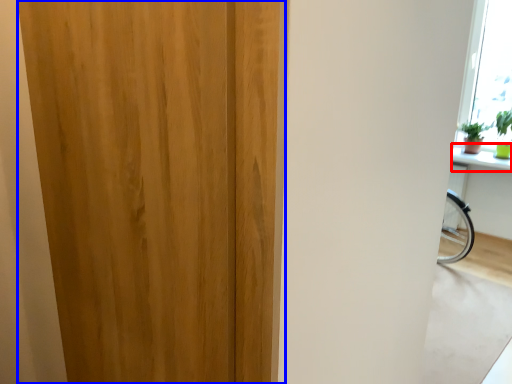
Question: Which of the following is the farthest to the observer, window sill (highlighted by a red box) or door (highlighted by a blue box)?

Choices:
 (A) window sill
 (B) door

Answer: (A)